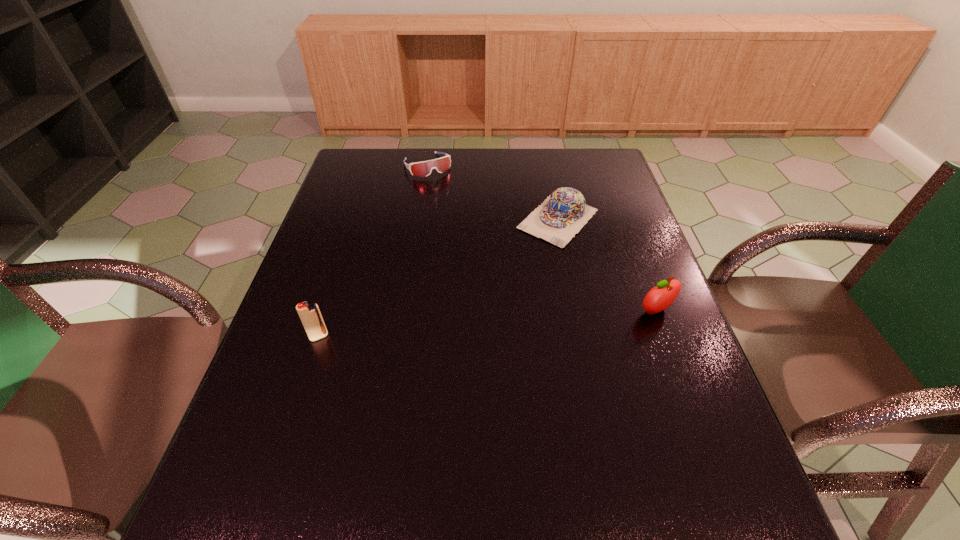
Image resolution: width=960 pixels, height=540 pixels. What are the coordinates of `blank area located on the front, side, and top of the second object from right to left` in the screenshot? It's located at (453, 329).

Locate an element on the screen. free space located 0.180m on the front, side, and top of the second object from right to left is located at coordinates (500, 281).

Locate an element on the screen. vacant space positioned on the front, side, and top of the second object from right to left is located at coordinates (453, 329).

The image size is (960, 540). Find the location of `vacant area situated on the front-facing side of the third object from right to left`. vacant area situated on the front-facing side of the third object from right to left is located at coordinates (444, 191).

Where is `vacant space located 0.090m on the front-facing side of the third object from right to left`? The width and height of the screenshot is (960, 540). vacant space located 0.090m on the front-facing side of the third object from right to left is located at coordinates (444, 193).

Where is `free region located 0.070m on the front-facing side of the third object from right to left`? The image size is (960, 540). free region located 0.070m on the front-facing side of the third object from right to left is located at coordinates (443, 190).

This screenshot has width=960, height=540. Find the location of `object that is positioned at the far edge`. object that is positioned at the far edge is located at coordinates (423, 169).

Identify the location of object present at the left edge. (310, 315).

This screenshot has height=540, width=960. Find the location of `apple at the right edge`. apple at the right edge is located at coordinates (660, 297).

Find the location of a particular element. cap that is at the right edge is located at coordinates (563, 214).